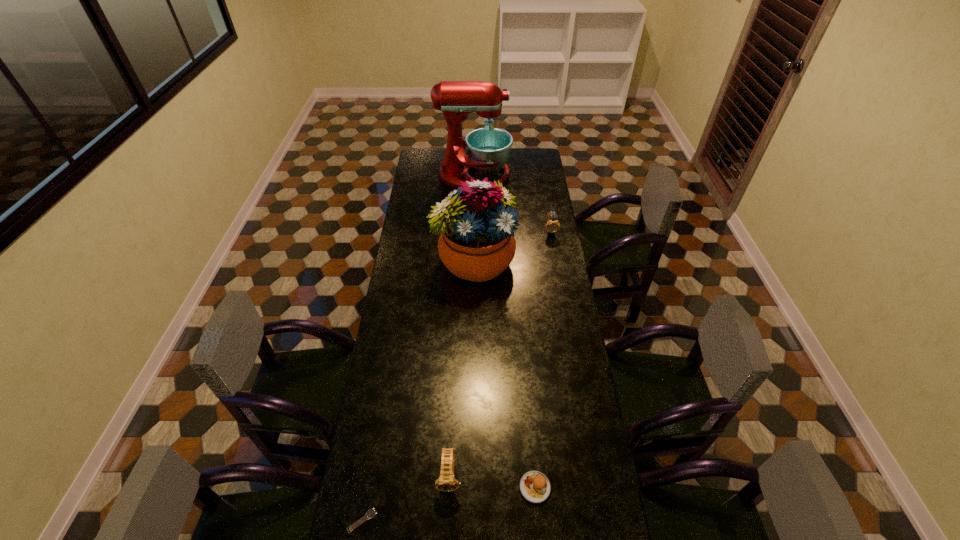
Find the location of `vacant space that satisfies the following two spatial constraints: 1. on the face of the second nearest watch; 2. on the left side of the patty`. vacant space that satisfies the following two spatial constraints: 1. on the face of the second nearest watch; 2. on the left side of the patty is located at coordinates (449, 487).

At what (x,y) coordinates should I click in order to perform the action: click on vacant point that satisfies the following two spatial constraints: 1. on the back side of the second shortest object; 2. on the front-facing side of the mixer. Please return your answer as a coordinate pair (x, y). The width and height of the screenshot is (960, 540). Looking at the image, I should click on (510, 176).

Where is `free space that satisfies the following two spatial constraints: 1. on the front-facing side of the farthest object; 2. on the back side of the flower arrangement`? free space that satisfies the following two spatial constraints: 1. on the front-facing side of the farthest object; 2. on the back side of the flower arrangement is located at coordinates (472, 261).